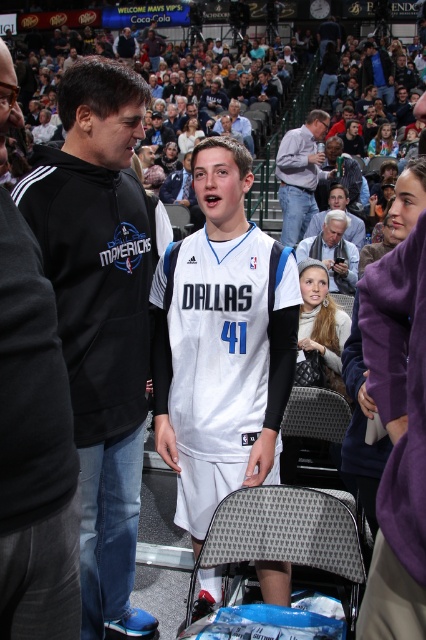
Question: Is light blue shirt at center further to the viewer compared to white hair at upper center?

Choices:
 (A) no
 (B) yes

Answer: (B)

Question: Estimate the real-world distances between objects in this image. Which object is farther from the dark blue hoodie at upper left?

Choices:
 (A) black hoodie at left
 (B) black fleece hoodie at left

Answer: (A)

Question: Among these points, which one is nearest to the camera?

Choices:
 (A) (273, 292)
 (B) (74, 605)
 (C) (250, 140)

Answer: (B)

Question: Does light blue shirt at center have a larger size compared to dark blue hoodie at upper left?

Choices:
 (A) yes
 (B) no

Answer: (B)

Question: Which point is farther to the camera?

Choices:
 (A) (302, 161)
 (B) (253, 150)

Answer: (B)

Question: Is black fleece hoodie at left wider than dark blue hoodie at upper left?

Choices:
 (A) yes
 (B) no

Answer: (B)